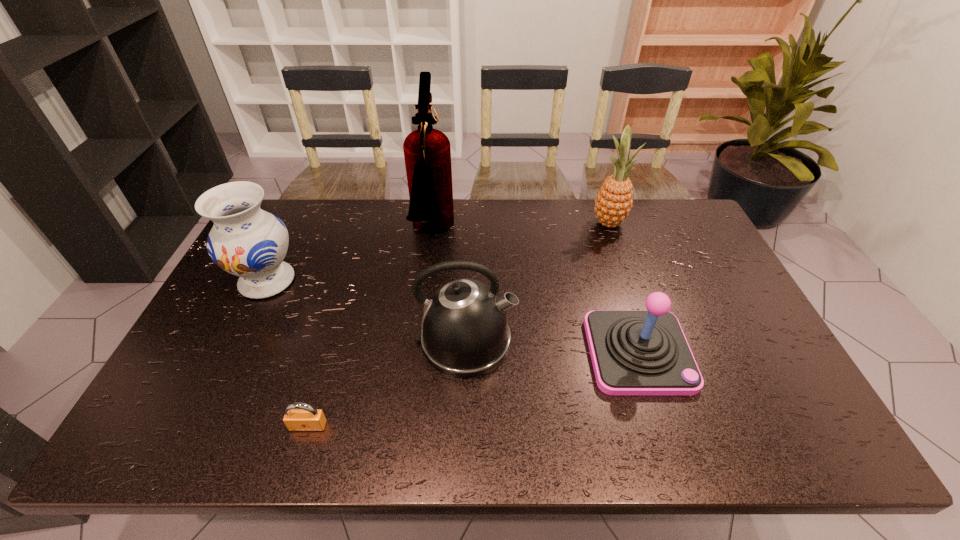
At what (x,y) coordinates should I click in order to perform the action: click on vacant space located on the spout of the kettle. Please return your answer as a coordinate pair (x, y). The image size is (960, 540). Looking at the image, I should click on (654, 341).

Find the location of `vacant space situated forward from the base of the second shortest object`. vacant space situated forward from the base of the second shortest object is located at coordinates (664, 435).

Where is `fire extinguisher that is positioned at the far edge`? fire extinguisher that is positioned at the far edge is located at coordinates (427, 152).

At what (x,y) coordinates should I click in order to perform the action: click on pineapple that is at the far edge. Please return your answer as a coordinate pair (x, y). Image resolution: width=960 pixels, height=540 pixels. Looking at the image, I should click on (614, 201).

Where is `object present at the near edge`? The height and width of the screenshot is (540, 960). object present at the near edge is located at coordinates (299, 416).

In order to click on object that is positioned at the left edge in this screenshot , I will do `click(246, 241)`.

This screenshot has width=960, height=540. In the image, there is a desktop. What are the coordinates of `vacant space at the far edge` in the screenshot? It's located at (540, 205).

In the image, there is a desktop. Identify the location of vacant space at the near edge. (706, 420).

The width and height of the screenshot is (960, 540). I want to click on free space at the left edge of the desktop, so click(171, 395).

Locate an element on the screen. This screenshot has height=540, width=960. blank area at the right edge is located at coordinates (708, 261).